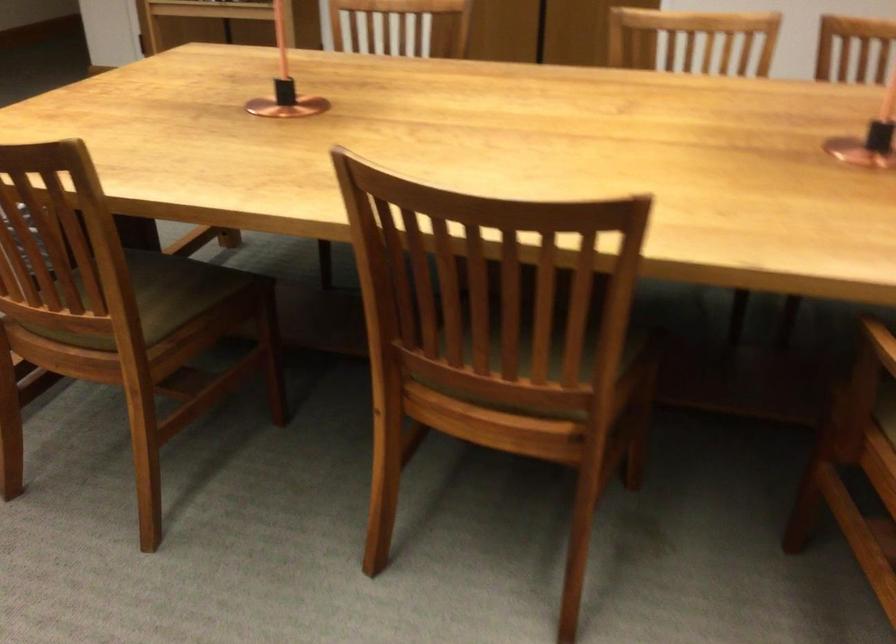
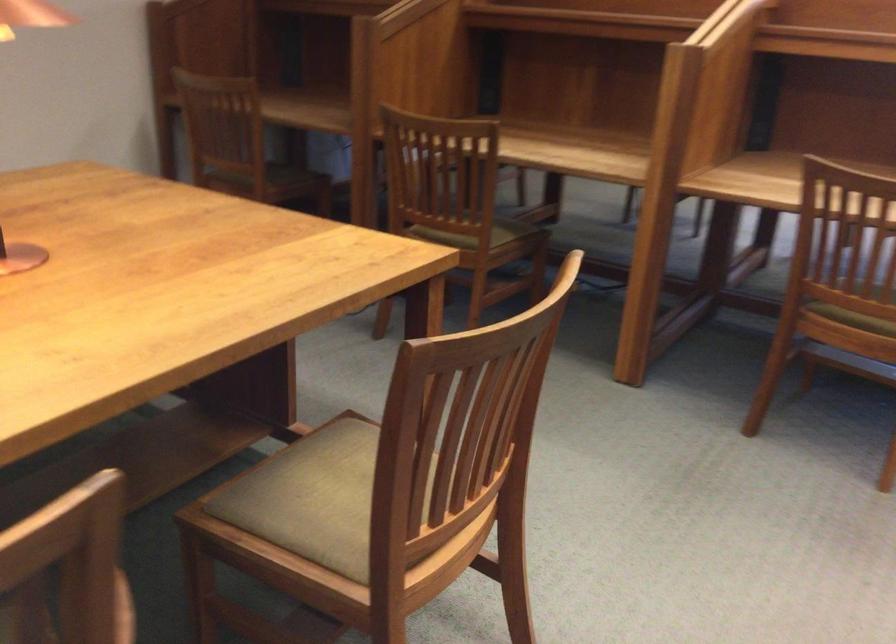
How did the camera likely rotate?

The camera rotated toward left-down.